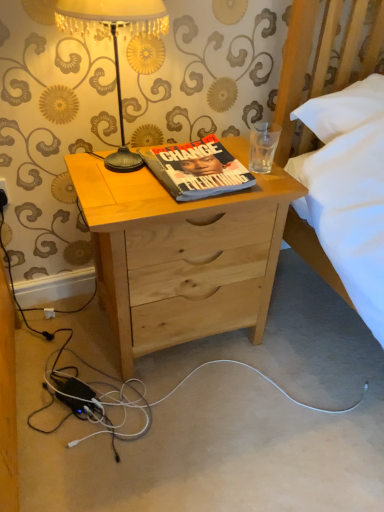
Locate an element on the screen. vacant space underneath gold textured lampshade at upper left (from a real-world perspective) is located at coordinates (121, 170).